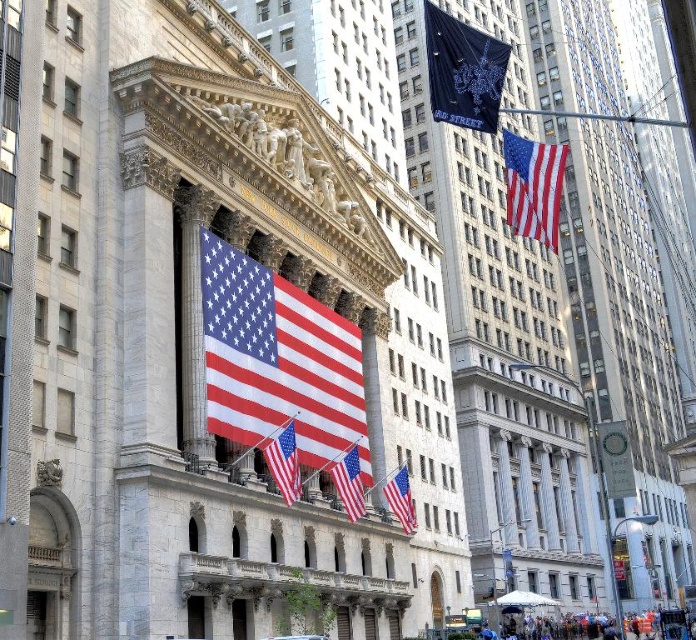
What do you see at coordinates (464, 72) in the screenshot? I see `black fabric banner at upper center` at bounding box center [464, 72].

This screenshot has height=640, width=696. What do you see at coordinates (464, 72) in the screenshot?
I see `black fabric banner at upper center` at bounding box center [464, 72].

The width and height of the screenshot is (696, 640). Find the location of `black fabric banner at upper center`. black fabric banner at upper center is located at coordinates (464, 72).

Can you confirm if red-white-blue fabric flag at upper right is taller than matte fabric flag at center?

Indeed, red-white-blue fabric flag at upper right has a greater height compared to matte fabric flag at center.

Which of these two, red-white-blue fabric flag at upper right or matte fabric flag at center, stands taller?

red-white-blue fabric flag at upper right is taller.

Does point (537, 208) come farther from viewer compared to point (269, 468)?

No, it is in front of (269, 468).

Image resolution: width=696 pixels, height=640 pixels. I want to click on red-white-blue fabric flag at upper right, so click(532, 186).

Which is below, matte fabric flag at center or matte white flag at center?

matte white flag at center is lower down.

Which is more to the right, matte fabric flag at center or matte white flag at center?

matte white flag at center

Is point (290, 467) positioned before point (413, 525)?

That is True.

The height and width of the screenshot is (640, 696). Find the location of `matte fabric flag at center`. matte fabric flag at center is located at coordinates (284, 464).